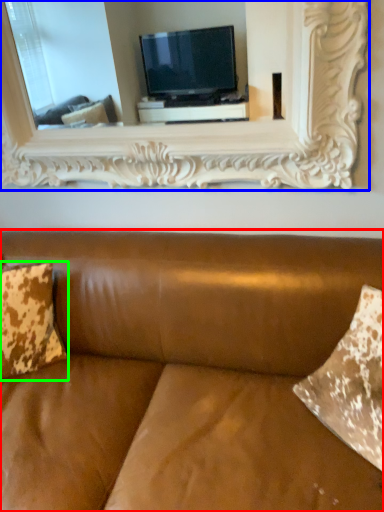
Question: Which object is the closest to the studio couch (highlighted by a red box)? Choose among these: picture frame (highlighted by a blue box) or pillow (highlighted by a green box).

Choices:
 (A) picture frame
 (B) pillow

Answer: (B)